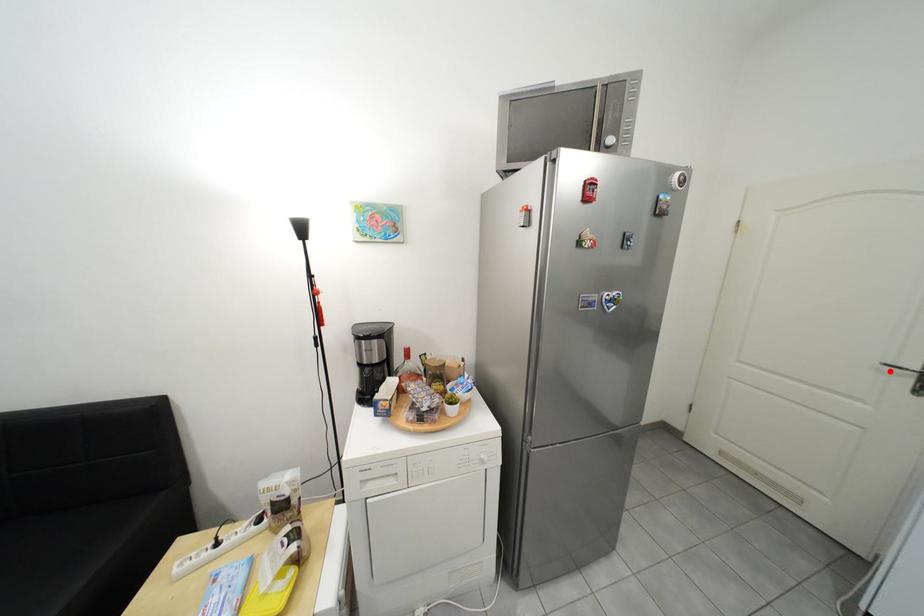
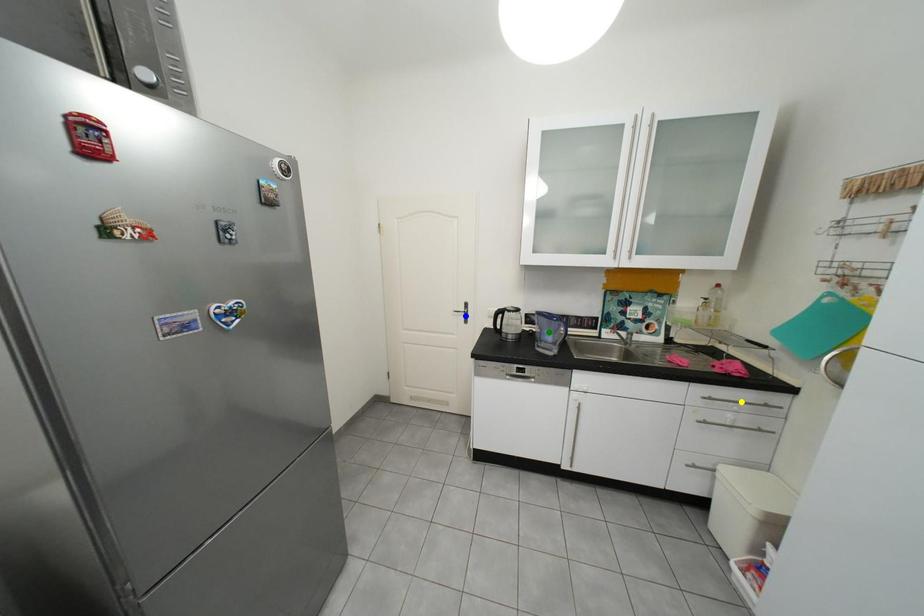
Question: I am providing you with two images of the same scene from different viewpoints. A red point is marked on the first image. You are given multiple points on the second image. Which mark in image 2 goes with the point in image 1?

Choices:
 (A) yellow point
 (B) green point
 (C) blue point

Answer: (C)